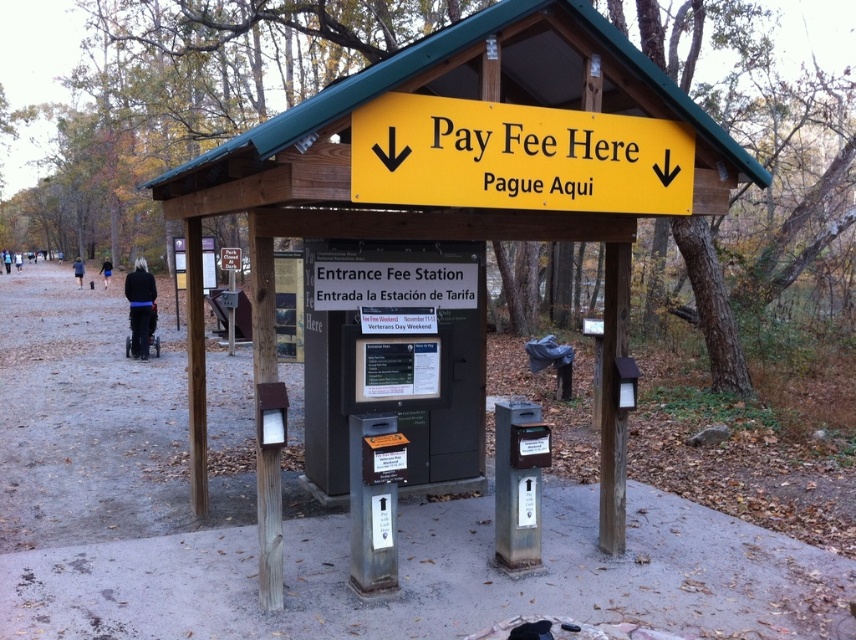
You are standing at the park entrance and want to locate the fee station. There are two points marked in the image. Which point is closer to the entrance? The points are point (259, 470) and point (663, 148).

Point (259, 470) is in front of point (663, 148), so it is closer to the entrance.

You are a visitor who wants to pay the entrance fee and see both the wooden sign at center and the yellow matte sign at center. Which one do you need to look at first if you want to read the larger sign?

The wooden sign at center is bigger than the yellow matte sign at center, so you should look at the wooden sign at center first.